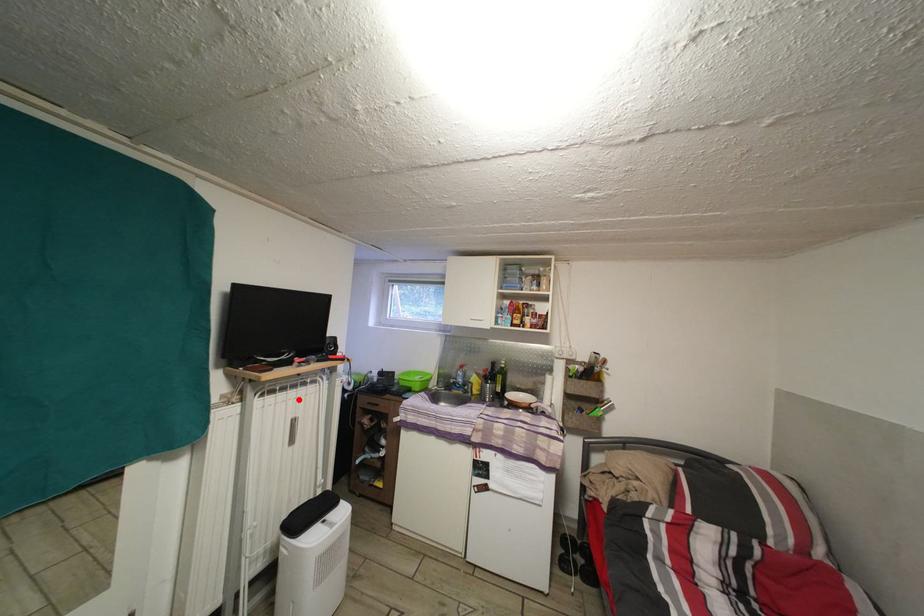
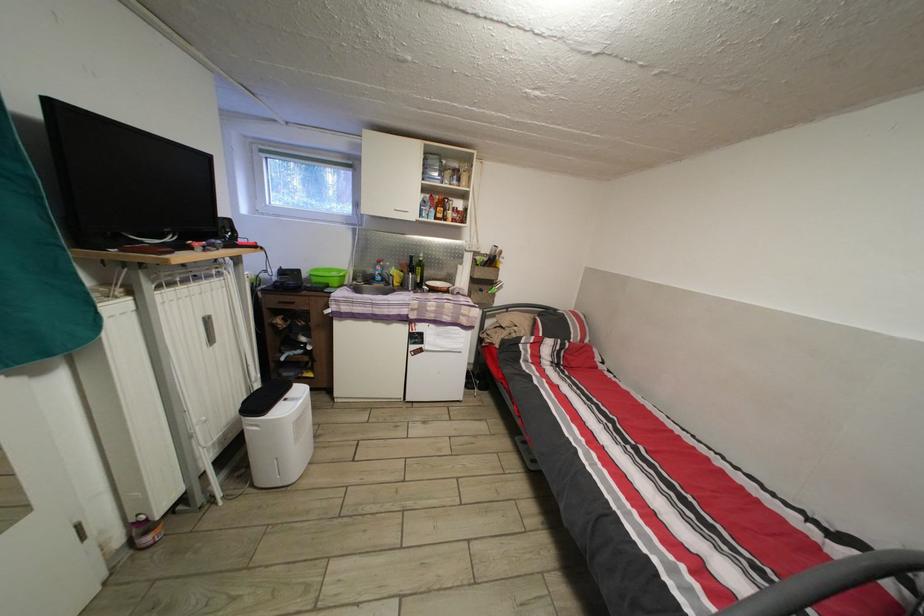
Where in the second image is the point corresponding to the highlighted location from the first image?

(201, 294)